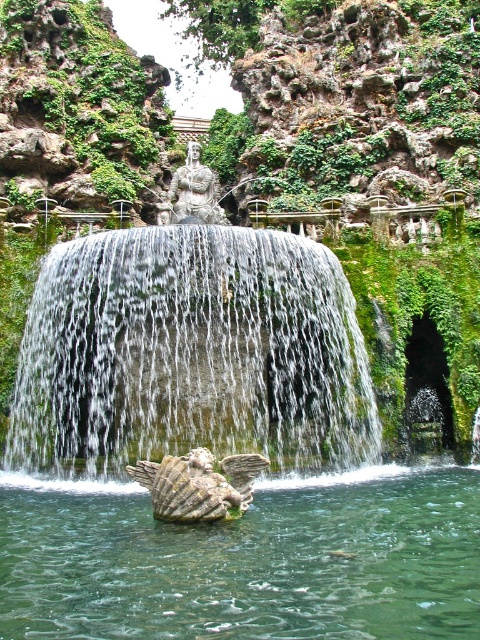
You are a visitor standing in front of the fountain. You want to take a photo of the stone winged creature at center without the white textured water at center blocking it. Is this possible?

The stone winged creature at center is behind the white textured water at center, so it is blocked by the water. Therefore, you cannot take a photo of the stone winged creature at center without the white textured water at center blocking it.

You are a landscape architect designing a walking path around the fountain. The path must be at least 5 meters wide to accommodate visitors comfortably. Given the distance between the clear stone water at center and the stone winged creature at center, can the path be safely placed between them without being too narrow?

The clear stone water at center is 6.21 meters from the stone winged creature at center. Since the required path width is at least 5 meters, the 6.21 meters distance allows for a sufficiently wide path between them, ensuring it meets the design specifications.

You are a landscape architect designing a new garden and want to incorporate both the white textured water at center and the stone winged creature at center. Based on the scene, which object occupies a greater horizontal space in the image?

The white textured water at center has a greater width than the stone winged creature at center, so it occupies more horizontal space.